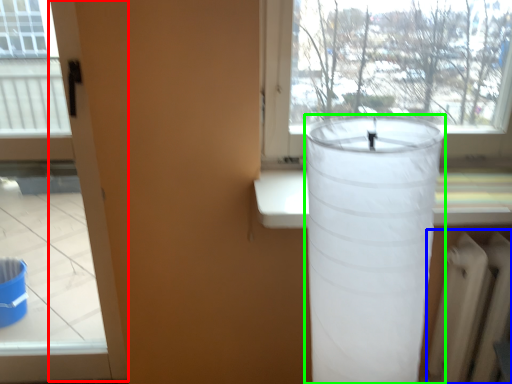
Question: Based on their relative distances, which object is nearer to screen door (highlighted by a red box)? Choose from radiator (highlighted by a blue box) and lamp (highlighted by a green box).

Choices:
 (A) radiator
 (B) lamp

Answer: (B)